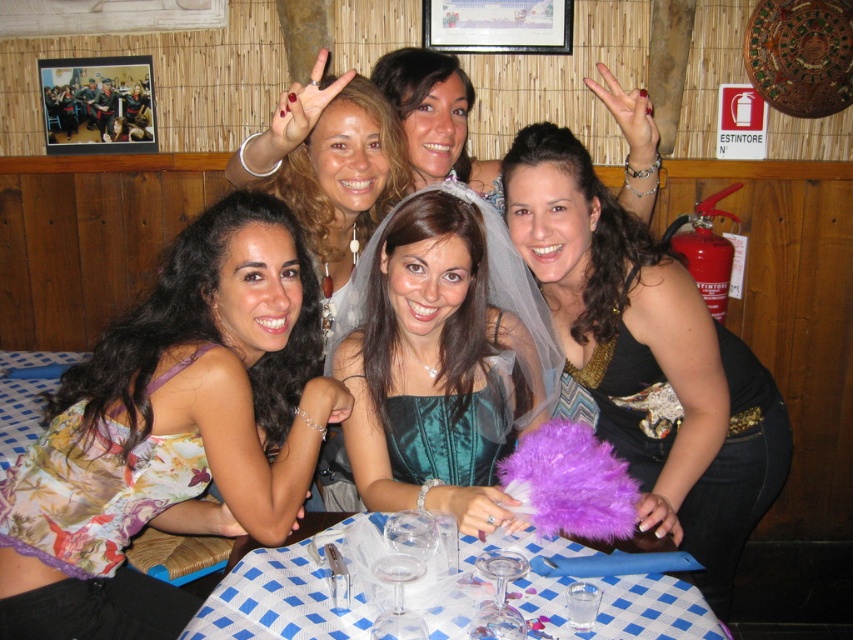
Question: Does floral print dress at lower left come in front of matte white veil at center?

Choices:
 (A) no
 (B) yes

Answer: (B)

Question: Considering the real-world distances, which object is farthest from the teal satin dress at center?

Choices:
 (A) satin teal dress at center
 (B) floral print dress at lower left
 (C) shiny black dress at center
 (D) matte white veil at center

Answer: (D)

Question: Which object is positioned closest to the teal satin dress at center?

Choices:
 (A) satin teal dress at center
 (B) floral print dress at lower left
 (C) matte white veil at center

Answer: (A)

Question: Is floral print dress at lower left positioned behind shiny black dress at center?

Choices:
 (A) no
 (B) yes

Answer: (A)

Question: Which point is farther to the camera?

Choices:
 (A) floral print dress at lower left
 (B) satin teal dress at center

Answer: (B)

Question: Can you confirm if shiny black dress at center is thinner than matte white veil at center?

Choices:
 (A) yes
 (B) no

Answer: (B)